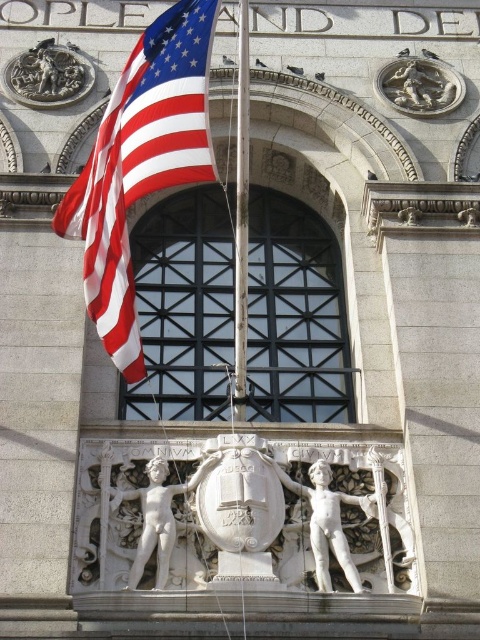
Between white marble cherub at center and silver metallic lion at upper right, which one appears on the right side from the viewer's perspective?

silver metallic lion at upper right is more to the right.

Can you confirm if white marble cherub at center is positioned above silver metallic lion at upper right?

Actually, white marble cherub at center is below silver metallic lion at upper right.

Describe the element at coordinates (157, 516) in the screenshot. This screenshot has height=640, width=480. I see `white marble cherub at center` at that location.

Where is `white marble cherub at center`? white marble cherub at center is located at coordinates (157, 516).

Find the location of `white marble statue at center`. white marble statue at center is located at coordinates (325, 522).

Image resolution: width=480 pixels, height=640 pixels. I want to click on white marble statue at center, so click(x=325, y=522).

Is red/white striped fabric at left smaller than white marble statue at center?

No.

Between point (211, 35) and point (324, 468), which one is positioned in front?

Point (211, 35) is more forward.

Who is more forward, (133, 147) or (317, 518)?

Positioned in front is point (133, 147).

Locate an element on the screen. This screenshot has width=480, height=640. red/white striped fabric at left is located at coordinates (141, 164).